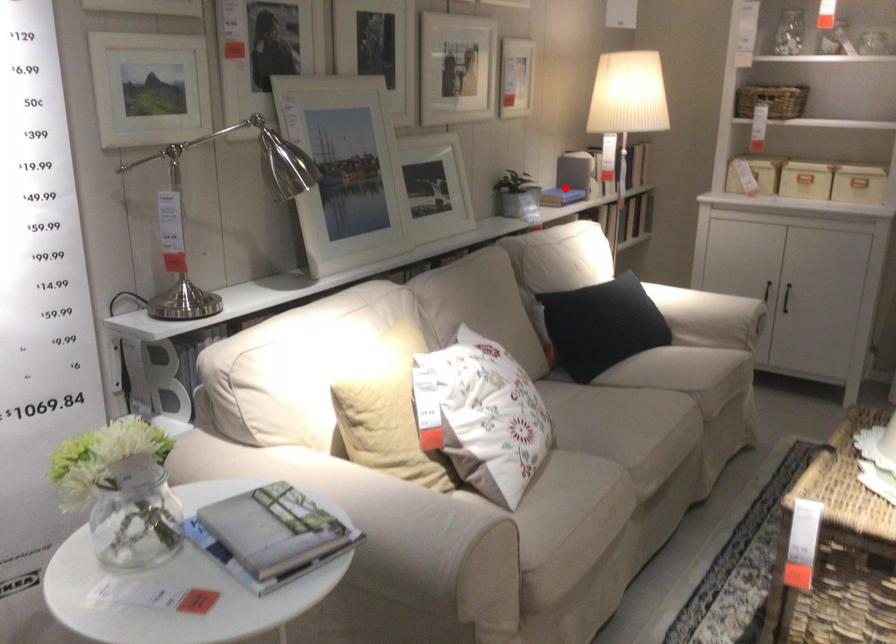
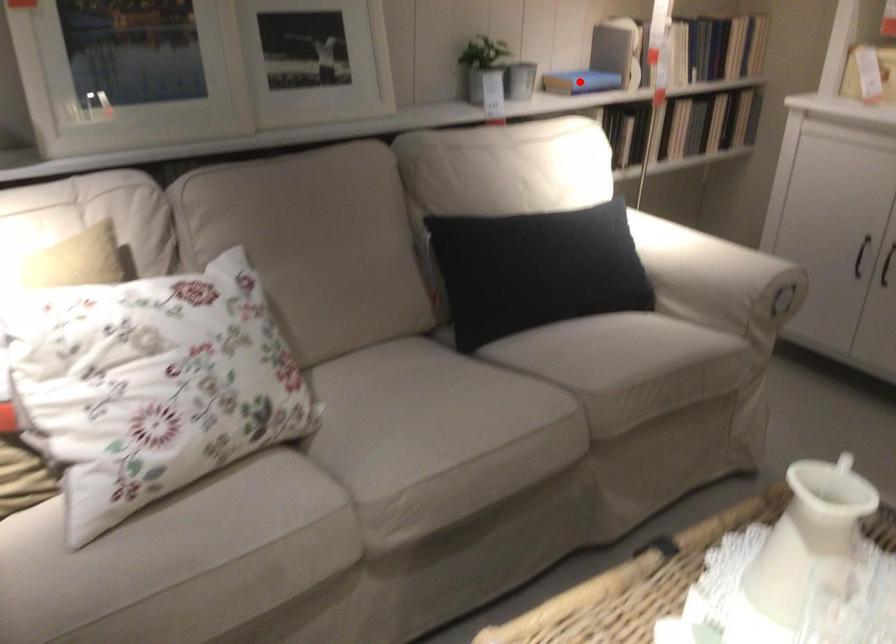
I am providing you with two images of the same scene from different viewpoints. A red point is marked on the first image and another point is marked on the second image. Does the point marked in image1 correspond to the same location as the one in image2?

Yes